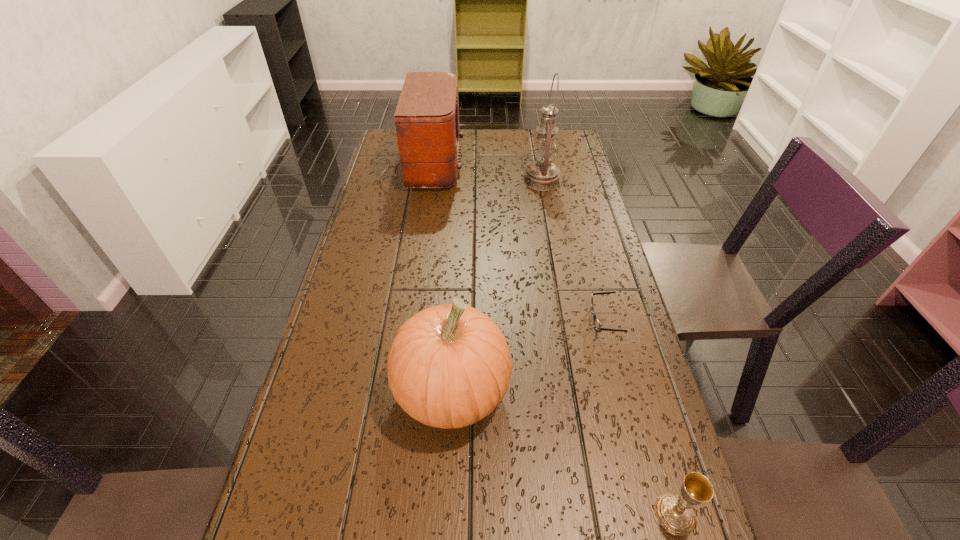
What are the coordinates of `vacant space at the far edge of the desktop` in the screenshot? It's located at (483, 131).

Image resolution: width=960 pixels, height=540 pixels. I want to click on free location at the left edge, so click(x=361, y=504).

This screenshot has width=960, height=540. I want to click on free space at the right edge, so click(570, 191).

Where is `vacant space that's between the oil lamp and the nearest object`? This screenshot has height=540, width=960. vacant space that's between the oil lamp and the nearest object is located at coordinates (609, 347).

This screenshot has height=540, width=960. Find the location of `free space between the pumpkin and the radio receiver`. free space between the pumpkin and the radio receiver is located at coordinates (437, 278).

This screenshot has width=960, height=540. I want to click on vacant space that's between the fourth tallest object and the shortest object, so click(x=639, y=417).

Locate an element on the screen. free space between the second shortest object and the oil lamp is located at coordinates 609,347.

In order to click on free space between the nearest object and the radio receiver in this screenshot , I will do `click(548, 340)`.

Locate an element on the screen. The image size is (960, 540). free point between the radio receiver and the shortest object is located at coordinates (513, 243).

You are a GUI agent. You are given a task and a screenshot of the screen. Output one action in this format:
    pyautogui.click(x=<x>, y=<y>)
    Task: Click on the closest object to the nearest object
    This screenshot has height=540, width=960.
    Given the screenshot: What is the action you would take?
    pyautogui.click(x=449, y=366)